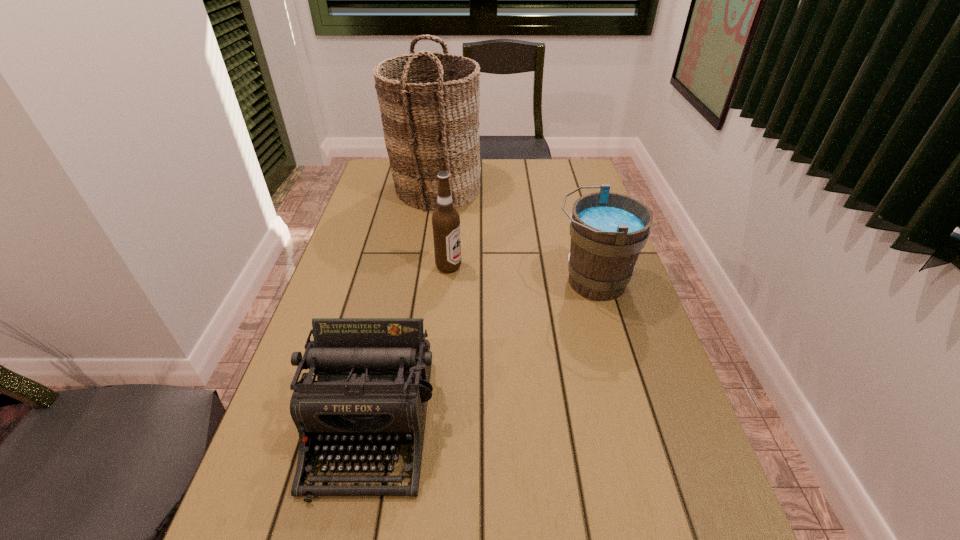
Identify the location of vacant space located 0.340m with a handle on the side of the second shortest object. The image size is (960, 540). (428, 282).

Locate an element on the screen. The image size is (960, 540). blank space located with a handle on the side of the second shortest object is located at coordinates (420, 282).

Identify the location of object that is at the far edge. The image size is (960, 540). (429, 126).

The image size is (960, 540). Find the location of `basket present at the left edge`. basket present at the left edge is located at coordinates (429, 126).

Where is `typewriter that is positioned at the left edge`? typewriter that is positioned at the left edge is located at coordinates (373, 386).

This screenshot has height=540, width=960. What are the coordinates of `object located in the right edge section of the desktop` in the screenshot? It's located at (608, 230).

Where is `object located in the far left corner section of the desktop`? object located in the far left corner section of the desktop is located at coordinates (429, 126).

At what (x,y) coordinates should I click in order to perform the action: click on vacant space at the far edge of the desktop. Please return your answer as a coordinate pair (x, y). The width and height of the screenshot is (960, 540). Looking at the image, I should click on (530, 186).

The height and width of the screenshot is (540, 960). What are the coordinates of `vacant space at the right edge of the desktop` in the screenshot? It's located at (716, 535).

Find the location of a particular element. free location at the far right corner is located at coordinates (589, 190).